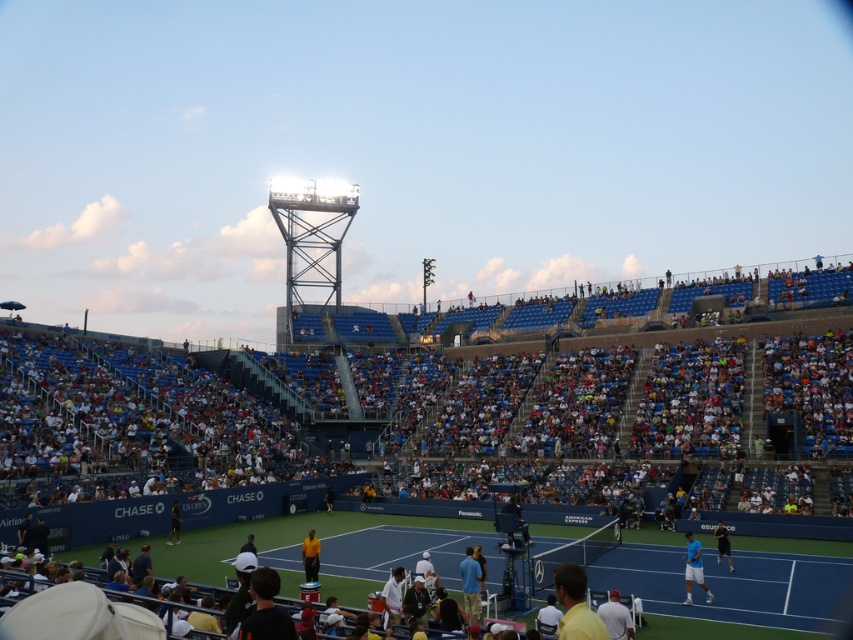
Looking at this image, you are a photographer at the tennis stadium and want to capture a photo that includes both the white fabric shirt at lower center and the dark blue shirt at lower right. Based on their positions, which shirt will appear higher in the photo?

The white fabric shirt at lower center will appear higher in the photo because it is positioned above the dark blue shirt at lower right.